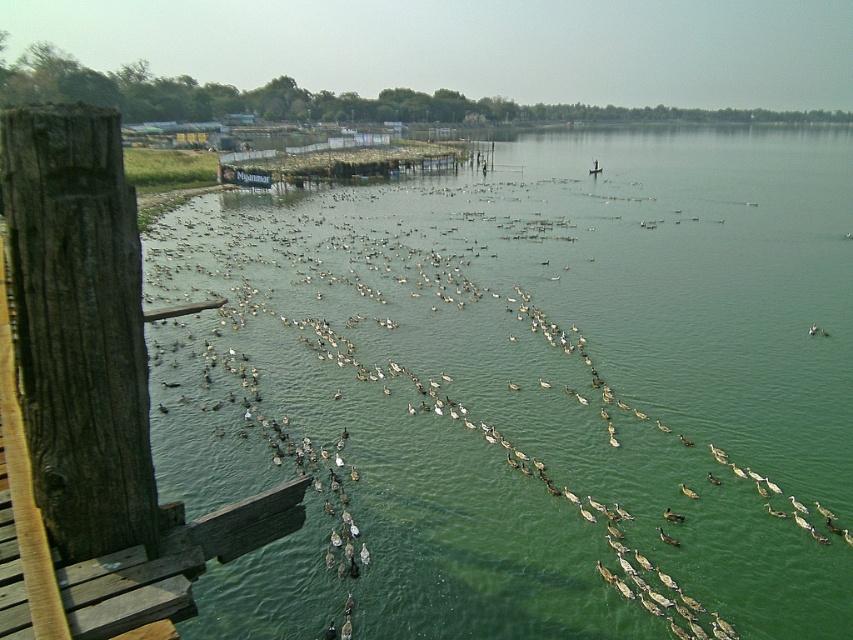
Measure the distance between point (560, 592) and camera.

They are 34.79 feet apart.

Is green water at center below wooden planks at lower left?

Incorrect, green water at center is not positioned below wooden planks at lower left.

Between point (416, 182) and point (138, 557), which one is positioned behind?

The point (416, 182) is more distant.

Where is `green water at center`? This screenshot has height=640, width=853. green water at center is located at coordinates (543, 376).